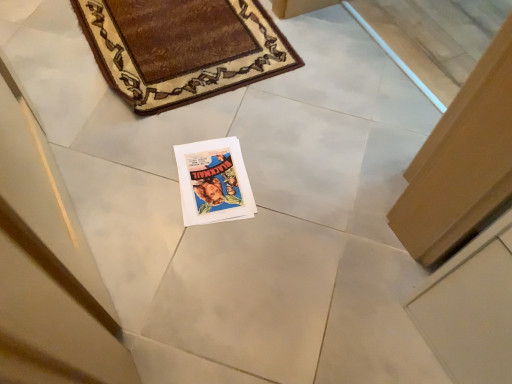
This screenshot has height=384, width=512. Identify the location of free spot above matte paper magazine at center (from a real-world perspective). (212, 173).